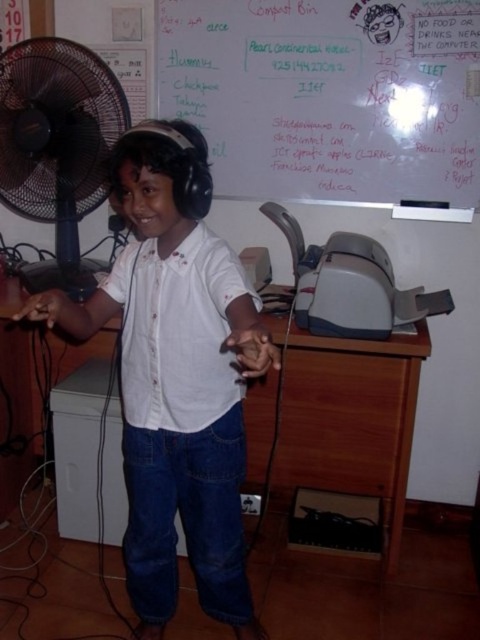
You are a teacher who needs to write on the whiteboard at upper center but there is a wooden object in the way. Can you move the wooden at center to access the whiteboard?

The wooden at center is behind the whiteboard at upper center, so it is not blocking the whiteboard. You can write on the whiteboard without moving the wooden at center.

You are a fashion designer who needs to place a logo on the white matte shirt at center. According to the coordinates given, where should you place the logo on the shirt?

The logo should be placed at point (177, 376) on the white matte shirt at center as specified in the coordinates.